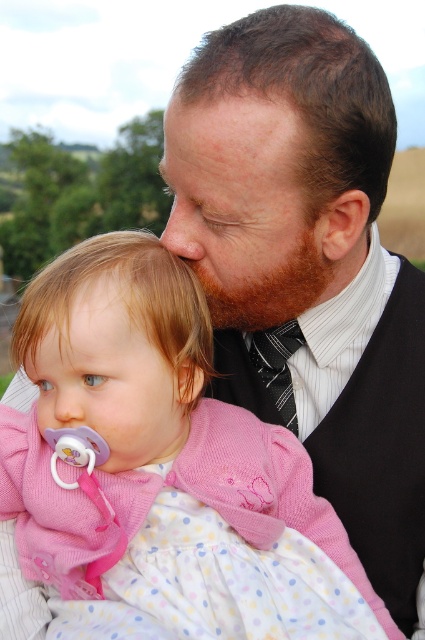
Is black silk tie at center behind matte skin nose at center?

That is True.

Between black silk tie at center and matte skin nose at center, which one has more height?

Standing taller between the two is matte skin nose at center.

Does point (289, 355) come closer to viewer compared to point (201, 253)?

No, (289, 355) is further to viewer.

At what (x,y) coordinates should I click in order to perform the action: click on black silk tie at center. Please return your answer as a coordinate pair (x, y). Image resolution: width=425 pixels, height=640 pixels. Looking at the image, I should click on (277, 365).

Can you confirm if smooth black tie at center is taller than pink knitted dress at center?

Yes, smooth black tie at center is taller than pink knitted dress at center.

Is point (314, 141) in front of point (51, 276)?

Yes, it is.

This screenshot has height=640, width=425. In order to click on smooth black tie at center in this screenshot , I will do `click(311, 262)`.

Find the location of `smooth black tie at center`. smooth black tie at center is located at coordinates point(311,262).

Who is shorter, black silk tie at center or pink matte pacifier at lower left?

Standing shorter between the two is pink matte pacifier at lower left.

Between black silk tie at center and pink matte pacifier at lower left, which one appears on the left side from the viewer's perspective?

Positioned to the left is pink matte pacifier at lower left.

Between point (289, 417) and point (74, 406), which one is positioned in front?

Point (74, 406)

I want to click on black silk tie at center, so click(277, 365).